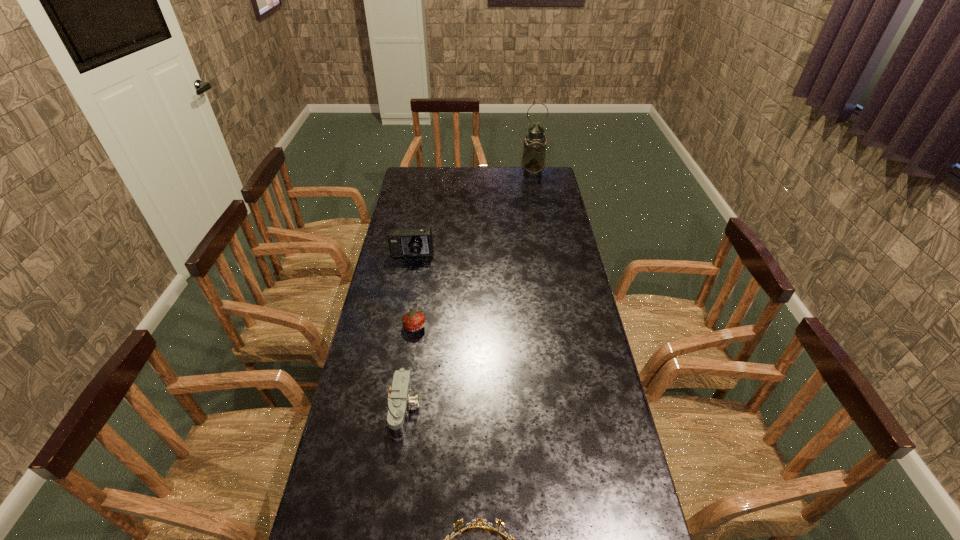
Where is `vacant space that's between the tomato and the farther camera`? This screenshot has height=540, width=960. vacant space that's between the tomato and the farther camera is located at coordinates (414, 292).

Find the location of a particular element. vacant point located between the nearer camera and the farther camera is located at coordinates (409, 334).

This screenshot has height=540, width=960. Find the location of `vacant space that's between the farther camera and the shorter camera`. vacant space that's between the farther camera and the shorter camera is located at coordinates 409,334.

Locate an element on the screen. free spot between the fourth shortest object and the tallest object is located at coordinates (472, 215).

Find the location of `free space between the third tallest object and the second farthest object`. free space between the third tallest object and the second farthest object is located at coordinates (409, 334).

Locate which object is the third closest to the rightmost object. Please provide its 2D coordinates. Your answer should be formatted as a tuple, i.e. [(x, y)], where the tuple contains the x and y coordinates of a point satisfying the conditions above.

[(400, 400)]

Identify which object is the second closest to the nearer camera. Please provide its 2D coordinates. Your answer should be formatted as a tuple, i.e. [(x, y)], where the tuple contains the x and y coordinates of a point satisfying the conditions above.

[(478, 520)]

Where is `vacant space that satisfies the following two spatial constraints: 1. on the front-facing side of the tomato; 2. on the right side of the fourth shortest object`? vacant space that satisfies the following two spatial constraints: 1. on the front-facing side of the tomato; 2. on the right side of the fourth shortest object is located at coordinates (399, 326).

Locate an element on the screen. vacant region that satisfies the following two spatial constraints: 1. on the front-facing side of the farther camera; 2. on the left side of the third nearest object is located at coordinates (399, 326).

I want to click on vacant space that satisfies the following two spatial constraints: 1. on the front-facing side of the third farthest object; 2. on the left side of the taller camera, so click(x=399, y=326).